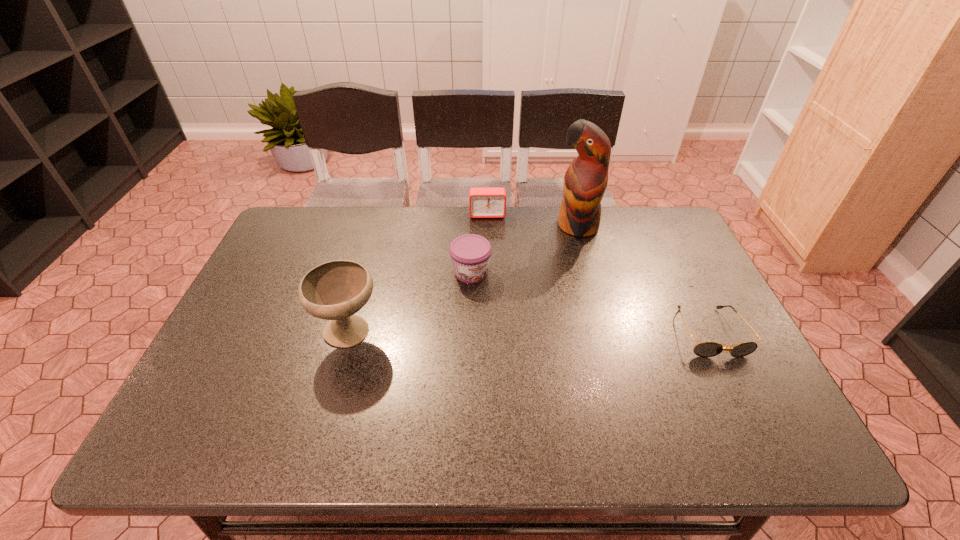
Locate an element on the screen. Image resolution: width=960 pixels, height=540 pixels. empty location between the fourth shortest object and the alarm clock is located at coordinates (419, 274).

This screenshot has height=540, width=960. What are the coordinates of `vacant space that's between the shortest object and the chalice` in the screenshot? It's located at (530, 333).

Locate an element on the screen. The width and height of the screenshot is (960, 540). vacant area between the shortest object and the chalice is located at coordinates (530, 333).

In order to click on blank region between the alarm clock and the leftmost object in this screenshot , I will do `click(419, 274)`.

Locate an element on the screen. vacant area between the alarm clock and the parrot is located at coordinates (532, 220).

This screenshot has width=960, height=540. I want to click on vacant region between the alarm clock and the tallest object, so (x=532, y=220).

The image size is (960, 540). Find the location of `vacant region between the shortest object and the second tallest object`. vacant region between the shortest object and the second tallest object is located at coordinates (530, 333).

Identify which object is the fourth closest to the leftmost object. Please provide its 2D coordinates. Your answer should be formatted as a tuple, i.e. [(x, y)], where the tuple contains the x and y coordinates of a point satisfying the conditions above.

[(705, 349)]

What are the coordinates of `object that stands as the second closest to the fourth object from left to right` in the screenshot? It's located at (470, 254).

Locate an element on the screen. The height and width of the screenshot is (540, 960). vacant point that satisfies the following two spatial constraints: 1. on the back side of the third farthest object; 2. on the left side of the fourth object from left to right is located at coordinates 472,226.